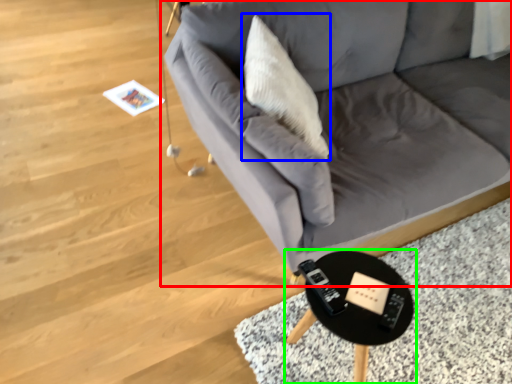
Question: Which object is the closest to the studio couch (highlighted by a red box)? Choose among these: throw pillow (highlighted by a blue box) or table (highlighted by a green box).

Choices:
 (A) throw pillow
 (B) table

Answer: (A)